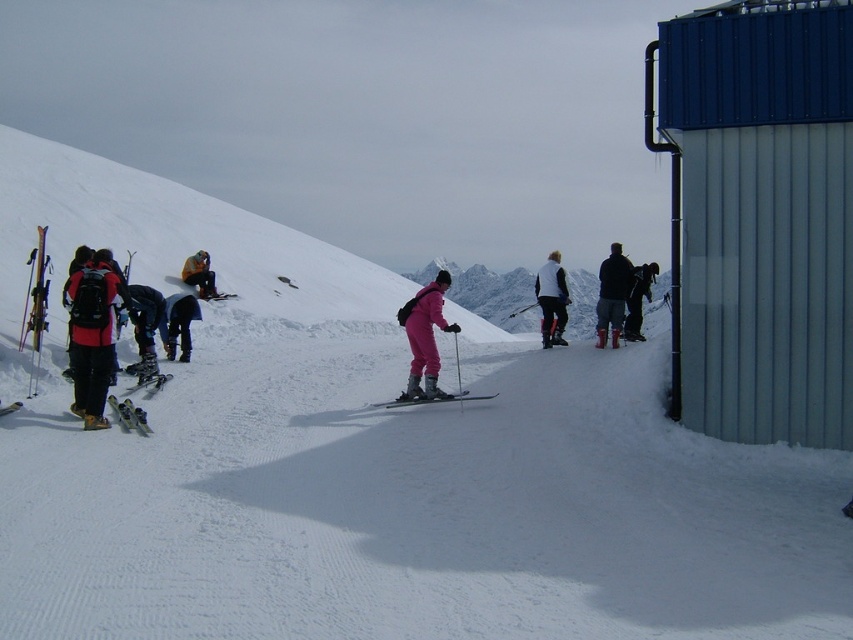
Between matte black backpack at left and matte black skis at center, which one is positioned higher?

matte black backpack at left

Is point (117, 307) positioned behind point (450, 394)?

No, it is not.

Image resolution: width=853 pixels, height=640 pixels. Identify the location of matte black backpack at left. (91, 336).

Which is in front, point (421, 300) or point (204, 269)?

Point (421, 300) is more forward.

Can you confirm if pink matte ski suit at center is shorter than yellow-orange jacket at center?

In fact, pink matte ski suit at center may be taller than yellow-orange jacket at center.

Find the location of a particular element. The width and height of the screenshot is (853, 640). pink matte ski suit at center is located at coordinates (424, 337).

Who is taller, pink matte snowboard at center or dark gray pants at center right?

With more height is dark gray pants at center right.

This screenshot has height=640, width=853. What do you see at coordinates (425, 344) in the screenshot?
I see `pink matte snowboard at center` at bounding box center [425, 344].

In order to click on pink matte snowboard at center in this screenshot , I will do `click(425, 344)`.